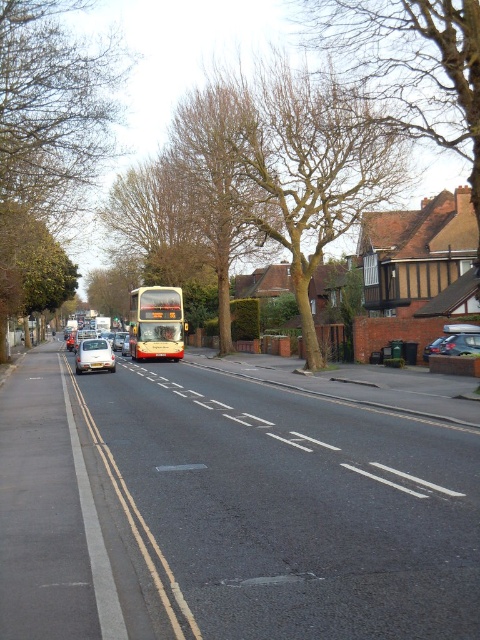
You are a pedestrian standing on the sidewalk and looking at the brown leafless tree at upper left and the brown leafless tree at upper center. Which tree appears taller from your viewpoint?

The brown leafless tree at upper center appears taller because it is taller than the brown leafless tree at upper left.

You are a pedestrian standing at the point marked by the coordinates point (48, 147). You want to walk to the bus traveling away from you on the road. Which direction should you head to reach the bus?

The point (48, 147) corresponds to the brown leafless tree at upper left. Since the bus is traveling away from you on the road, you should head towards the direction the bus is moving to intercept it or wait for it to return.

You are a pedestrian standing at the center of the road and want to cross to the sidewalk on the right. There is a white matte car at left. Based on the car position, which direction should you move to avoid the car?

The white matte car at left is at point (94, 355), so you should move to the left to avoid it.